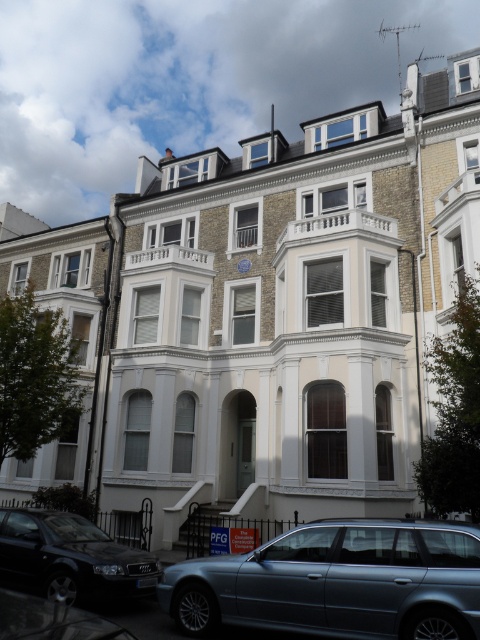
Is metallic silver car at lower center below black metallic car at lower left?

Incorrect, metallic silver car at lower center is not positioned below black metallic car at lower left.

Between metallic silver car at lower center and black metallic car at lower left, which one appears on the right side from the viewer's perspective?

metallic silver car at lower center

Is point (412, 554) behind point (60, 557)?

No, (412, 554) is in front of (60, 557).

Where is `metallic silver car at lower center`? This screenshot has width=480, height=640. metallic silver car at lower center is located at coordinates (337, 582).

Is metallic silver car at lower center below shiny silver car at lower left?

Indeed, metallic silver car at lower center is positioned under shiny silver car at lower left.

Is metallic silver car at lower center wider than shiny silver car at lower left?

Yes.

Is point (440, 568) more distant than point (1, 611)?

That is True.

Where is `metallic silver car at lower center`? This screenshot has width=480, height=640. metallic silver car at lower center is located at coordinates (337, 582).

Who is positioned more to the left, black metallic car at lower left or shiny silver car at lower left?

From the viewer's perspective, black metallic car at lower left appears more on the left side.

Is black metallic car at lower left closer to camera compared to shiny silver car at lower left?

No, black metallic car at lower left is further to the viewer.

The width and height of the screenshot is (480, 640). In order to click on black metallic car at lower left in this screenshot , I will do `click(72, 556)`.

The height and width of the screenshot is (640, 480). I want to click on black metallic car at lower left, so click(x=72, y=556).